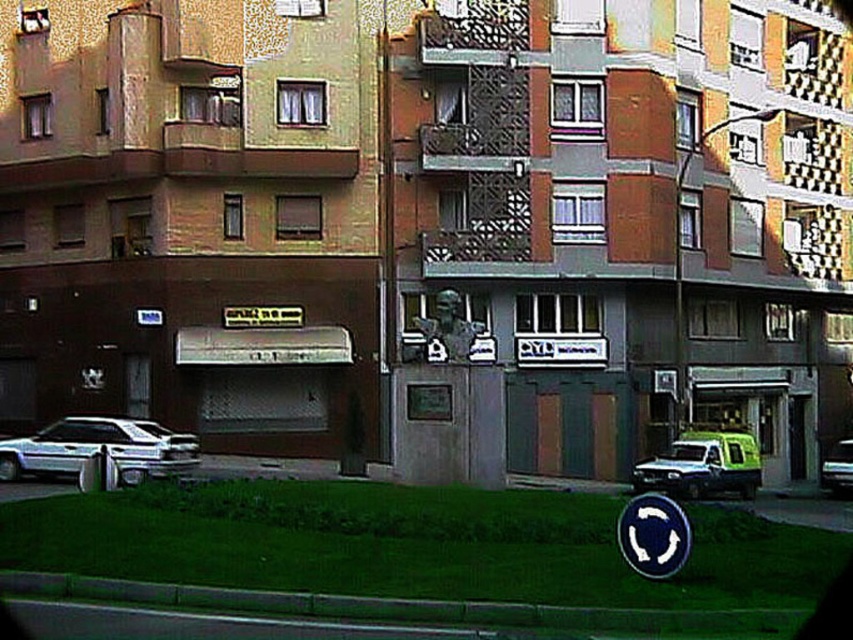
Can you confirm if white glossy car at lower left is taller than blue metallic circle at center?

Yes, white glossy car at lower left is taller than blue metallic circle at center.

Does white glossy car at lower left have a greater width compared to blue metallic circle at center?

Yes, white glossy car at lower left is wider than blue metallic circle at center.

What do you see at coordinates (97, 449) in the screenshot? I see `white glossy car at lower left` at bounding box center [97, 449].

Where is `white glossy car at lower left`? This screenshot has height=640, width=853. white glossy car at lower left is located at coordinates (97, 449).

Measure the distance between green matte van at lower right and camera.

They are 28.07 meters apart.

Which is in front, point (741, 497) or point (824, 458)?

Point (741, 497)

Does point (676, 451) come in front of point (827, 474)?

Yes, it is.

Locate an element on the screen. This screenshot has width=853, height=640. green matte van at lower right is located at coordinates (701, 465).

Can you confirm if blue metallic circle at center is positioned to the right of shiny silver van at right?

No, blue metallic circle at center is not to the right of shiny silver van at right.

Measure the distance between blue metallic circle at center and shiny silver van at right.

blue metallic circle at center is 92.92 feet away from shiny silver van at right.

The image size is (853, 640). Find the location of `blue metallic circle at center`. blue metallic circle at center is located at coordinates (653, 536).